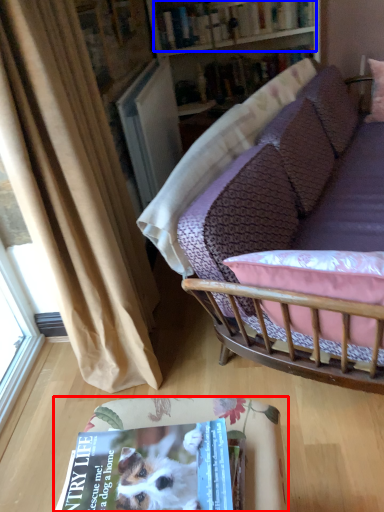
Question: Among these objects, which one is nearest to the camera, table (highlighted by a red box) or book (highlighted by a blue box)?

Choices:
 (A) table
 (B) book

Answer: (A)